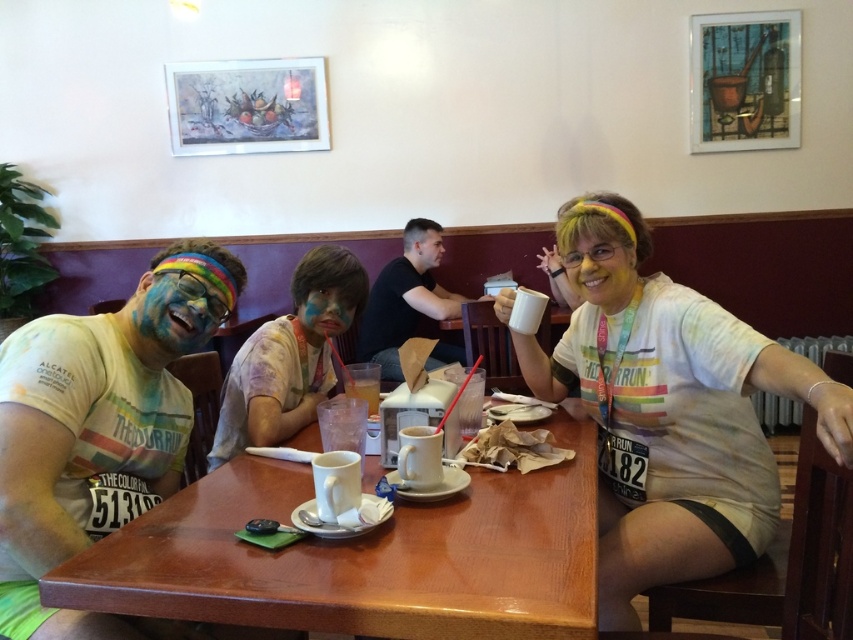
You are a photographer standing in front of the wooden table at center and the rainbow paint face at center. You want to take a photo that captures both subjects without any obstruction. Based on their heights, which subject should be placed closer to the camera to ensure both are fully visible?

The wooden table at center is not as tall as the rainbow paint face at center. To ensure both are fully visible, the rainbow paint face at center should be placed closer to the camera since it is taller and might block the view of the shorter wooden table at center if positioned behind.